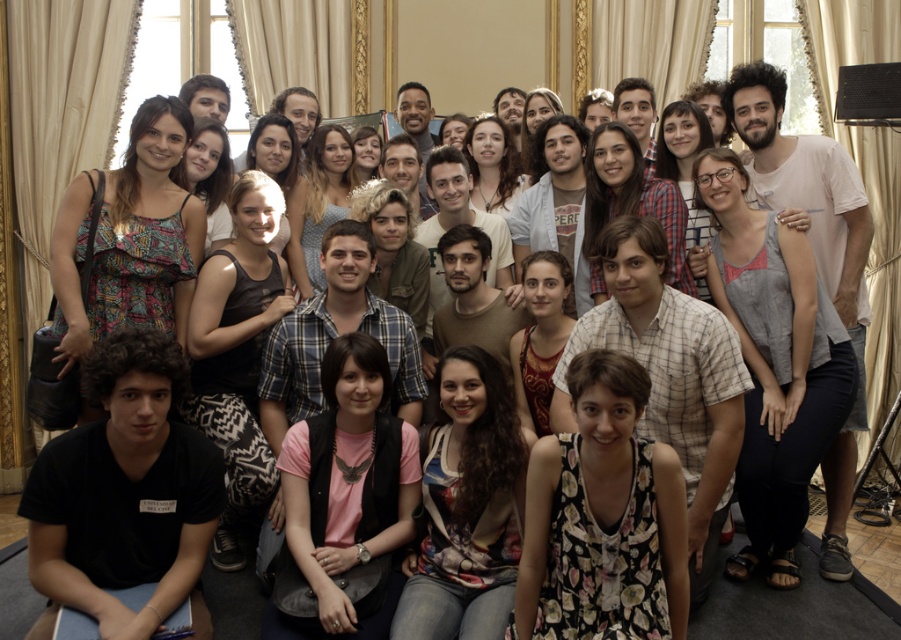
Can you confirm if floral print dress at center is positioned to the left of floral print top at center?

Incorrect, floral print dress at center is not on the left side of floral print top at center.

Who is more distant from viewer, [630,476] or [428,461]?

Point [428,461]

Is point (603, 465) farther from viewer compared to point (501, 568)?

No, (603, 465) is in front of (501, 568).

The height and width of the screenshot is (640, 901). What are the coordinates of `floral print dress at center` in the screenshot? It's located at (602, 518).

Who is taller, floral print top at center or gray fabric plaster bandage at right?

floral print top at center

From the picture: Can you confirm if floral print top at center is positioned to the right of gray fabric plaster bandage at right?

No, floral print top at center is not to the right of gray fabric plaster bandage at right.

You are a GUI agent. You are given a task and a screenshot of the screen. Output one action in this format:
    pyautogui.click(x=<x>, y=<y>)
    Task: Click on the floral print top at center
    The image size is (901, 640).
    Given the screenshot: What is the action you would take?
    pyautogui.click(x=467, y=506)

You are a GUI agent. You are given a task and a screenshot of the screen. Output one action in this format:
    pyautogui.click(x=<x>, y=<y>)
    Task: Click on the floral print top at center
    The height and width of the screenshot is (640, 901).
    Given the screenshot: What is the action you would take?
    pyautogui.click(x=467, y=506)

Which of these two, pink fabric shirt at center or gray fabric plaster bandage at right, stands taller?

Standing taller between the two is pink fabric shirt at center.

Which is in front, point (350, 620) or point (842, 467)?

Point (350, 620) is more forward.

Which is behind, point (370, 428) or point (843, 257)?

The point (843, 257) is behind.

This screenshot has height=640, width=901. Identify the location of pink fabric shirt at center. [x=346, y=490].